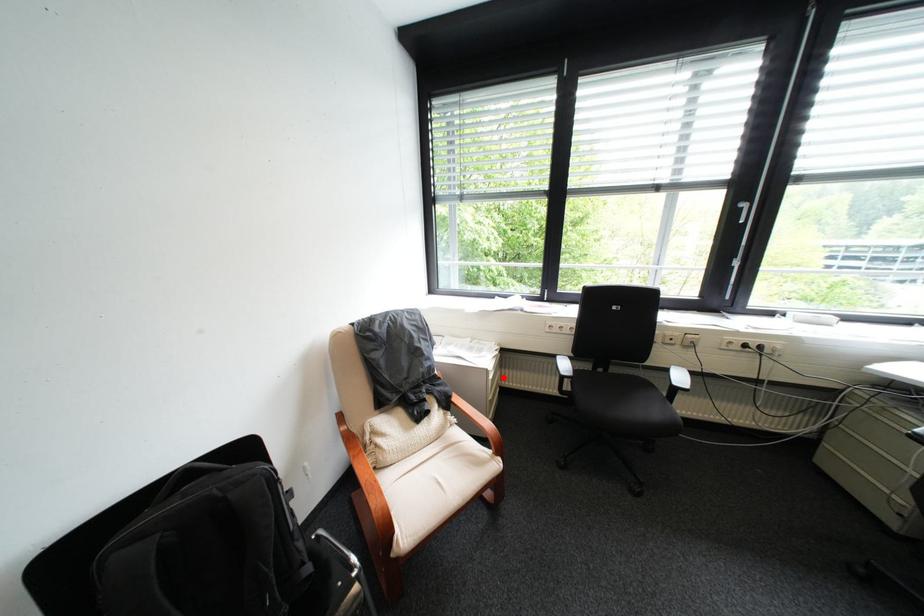
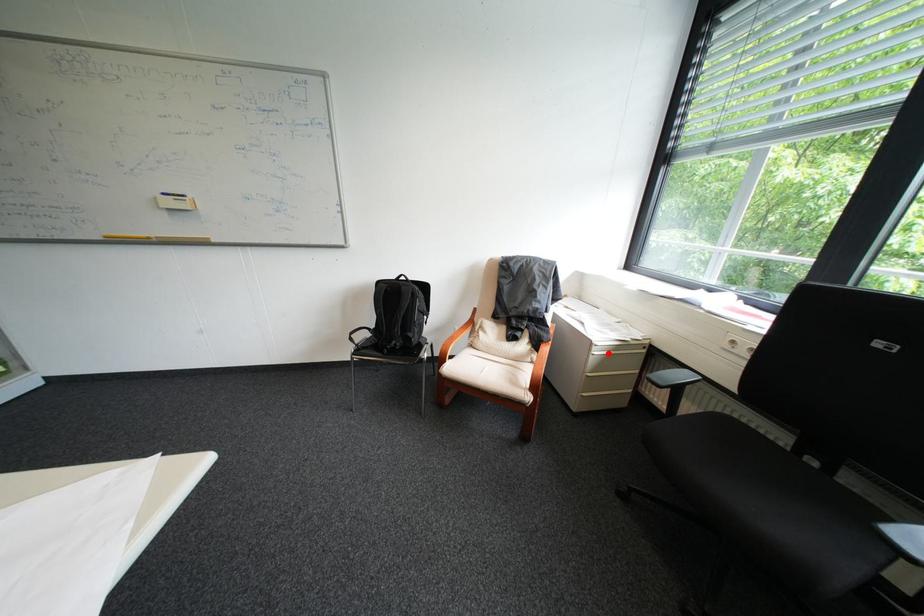
I am providing you with two images of the same scene from different viewpoints. A red point is marked on the first image and another point is marked on the second image. Are the points marked in image1 and image2 representing the same 3D position?

Yes